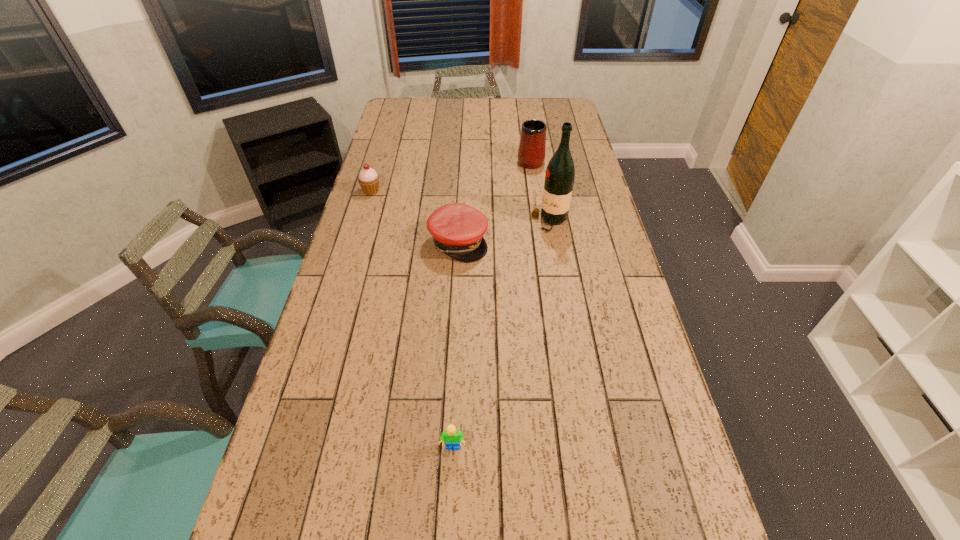
Where is `vacant space located 0.090m on the side of the fourth shortest object with the handle`? The width and height of the screenshot is (960, 540). vacant space located 0.090m on the side of the fourth shortest object with the handle is located at coordinates (527, 140).

Locate an element on the screen. This screenshot has width=960, height=540. free point located on the back of the cupcake is located at coordinates (379, 163).

Find the location of a particular element. This screenshot has width=960, height=540. free location located on the front-facing side of the cap is located at coordinates (599, 242).

Find the location of `blank area located 0.150m on the face of the Lego`. blank area located 0.150m on the face of the Lego is located at coordinates (449, 526).

In order to click on object present at the left edge in this screenshot , I will do `click(368, 179)`.

Where is `object present at the right edge`? This screenshot has height=540, width=960. object present at the right edge is located at coordinates (560, 173).

Image resolution: width=960 pixels, height=540 pixels. What are the coordinates of `free space at the far edge of the desktop` in the screenshot? It's located at (539, 116).

In the image, there is a desktop. Identify the location of free space at the left edge. (349, 360).

In the image, there is a desktop. Where is `vacant space at the right edge`? The image size is (960, 540). vacant space at the right edge is located at coordinates (594, 335).

Identify the location of free space at the far left corner of the desktop. Image resolution: width=960 pixels, height=540 pixels. (420, 110).